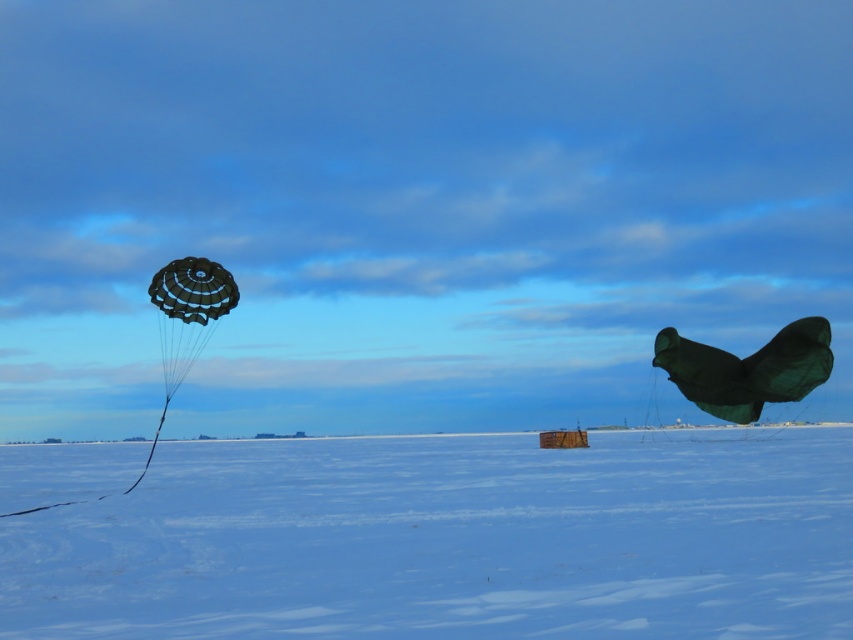
Which is behind, point (558, 528) or point (175, 291)?

The point (175, 291) is more distant.

Measure the distance between white matte snow at center and camera.

4.49 meters

In order to click on white matte snow at center in this screenshot , I will do `click(451, 540)`.

Between green matte kite at right and matte black parachute at left, which one is positioned lower?

green matte kite at right is below.

Locate an element on the screen. The height and width of the screenshot is (640, 853). green matte kite at right is located at coordinates tap(747, 369).

Who is more distant from viewer, (766,401) or (212,280)?

The point (766,401) is more distant.

The height and width of the screenshot is (640, 853). I want to click on green matte kite at right, so (x=747, y=369).

Which is above, white matte snow at center or green matte kite at right?

green matte kite at right

Which is behind, point (376, 474) or point (654, 349)?

Point (654, 349)

Find the location of a particular element. The image size is (853, 640). white matte snow at center is located at coordinates (451, 540).